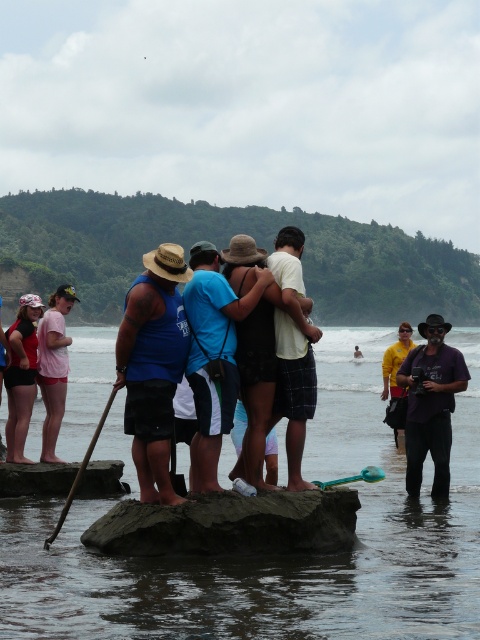
Question: Which object is farther from the camera taking this photo?

Choices:
 (A) dark purple fabric camera at lower right
 (B) matte black shirt at center
 (C) wooden paddle at center
 (D) clear water at center

Answer: (A)

Question: Is dark gray sandstone at center further to the viewer compared to blue fabric shirt at center?

Choices:
 (A) no
 (B) yes

Answer: (A)

Question: Is dark gray sandstone at center below teal plastic paddle at center?

Choices:
 (A) yes
 (B) no

Answer: (A)

Question: Which point is farther to the camera?

Choices:
 (A) matte red swimsuit at left
 (B) dark purple fabric camera at lower right

Answer: (A)

Question: Can you confirm if matte black shirt at center is wider than dark purple fabric camera at lower right?

Choices:
 (A) no
 (B) yes

Answer: (B)

Question: Among these points, which one is nearest to the camera?

Choices:
 (A) (348, 326)
 (B) (443, 460)
 (C) (90, 456)

Answer: (C)